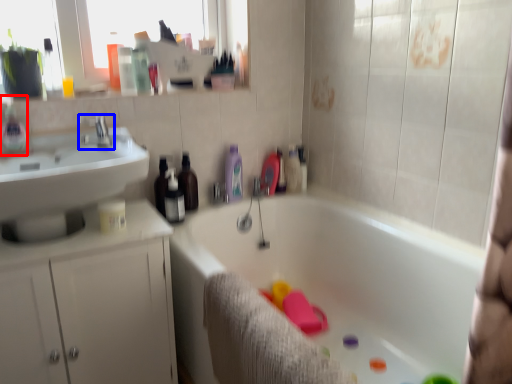
Question: Among these objects, which one is nearest to the camera, bottle (highlighted by a red box) or tap (highlighted by a blue box)?

Choices:
 (A) bottle
 (B) tap

Answer: (A)